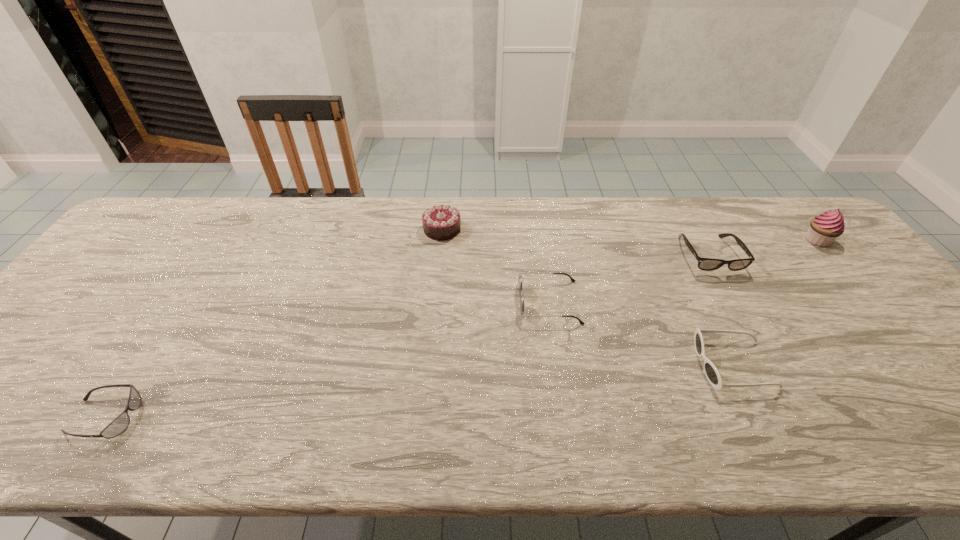
The width and height of the screenshot is (960, 540). Identify the location of cupcake present at the far edge. (824, 229).

This screenshot has height=540, width=960. I want to click on chocolate cake located in the far edge section of the desktop, so click(x=441, y=222).

Locate an element on the screen. spectacles that is at the far edge is located at coordinates (707, 264).

Locate an element on the screen. This screenshot has height=540, width=960. object at the near edge is located at coordinates (119, 424).

The height and width of the screenshot is (540, 960). I want to click on object present at the right edge, so click(x=824, y=229).

You are a GUI agent. You are given a task and a screenshot of the screen. Output one action in this format:
    pyautogui.click(x=<x>, y=<y>)
    Task: Click on the object situated at the far right corner
    The height and width of the screenshot is (540, 960).
    Given the screenshot: What is the action you would take?
    pyautogui.click(x=824, y=229)

At what (x,y) coordinates should I click in order to perform the action: click on vacant position at the far edge of the desktop. Please return your answer as a coordinate pair (x, y). The width and height of the screenshot is (960, 540). Looking at the image, I should click on (472, 233).

The image size is (960, 540). What are the coordinates of `vacant space at the near edge` in the screenshot? It's located at (846, 427).

Identify the location of free space at the left edge. This screenshot has width=960, height=540. (45, 380).

In the image, there is a desktop. Where is `vacant space at the right edge`? The width and height of the screenshot is (960, 540). vacant space at the right edge is located at coordinates (941, 384).